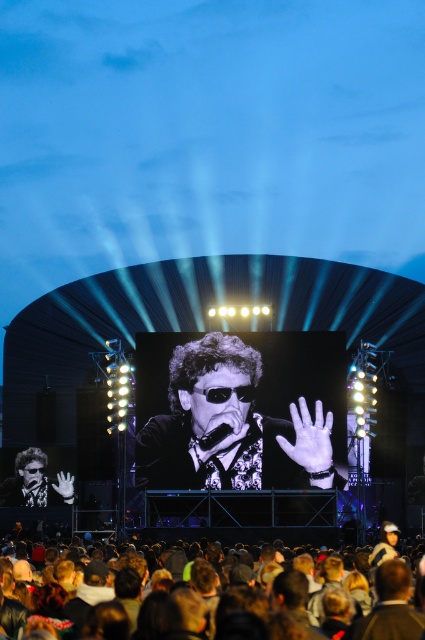
Measure the distance between black glossy sunglasses at center and brown hair at lower center.

black glossy sunglasses at center is 45.94 feet from brown hair at lower center.

Describe the element at coordinates (229, 420) in the screenshot. The width and height of the screenshot is (425, 640). I see `black glossy sunglasses at center` at that location.

Find the location of a particular element. black glossy sunglasses at center is located at coordinates (229, 420).

Who is lower down, black glossy sunglasses at center or matte black sunglasses at center?

matte black sunglasses at center

Who is positioned more to the right, black glossy sunglasses at center or matte black sunglasses at center?

black glossy sunglasses at center is more to the right.

Is point (158, 356) positioned after point (34, 452)?

No, (158, 356) is closer to viewer.

Where is `black glossy sunglasses at center`? The width and height of the screenshot is (425, 640). black glossy sunglasses at center is located at coordinates (229, 420).

Does matte black sunglasses at center have a greater height compared to brown hair at lower center?

Yes, matte black sunglasses at center is taller than brown hair at lower center.

Can you confirm if matte black sunglasses at center is positioned to the right of brown hair at lower center?

Incorrect, matte black sunglasses at center is not on the right side of brown hair at lower center.

Who is more forward, (0, 490) or (295, 528)?

Point (295, 528) is more forward.

Identify the location of matte black sunglasses at center. Image resolution: width=425 pixels, height=640 pixels. (34, 483).